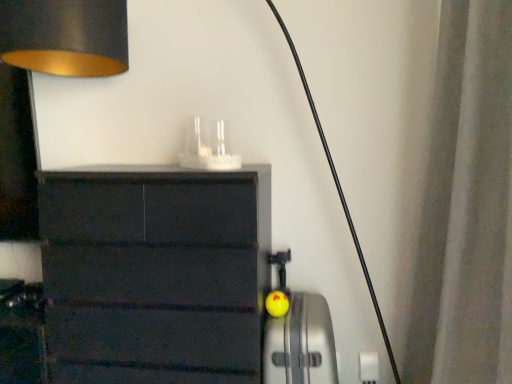
The image size is (512, 384). Describe the element at coordinates (466, 206) in the screenshot. I see `white fabric curtain at right` at that location.

In order to click on white fabric curtain at right in this screenshot , I will do `click(466, 206)`.

Measure the distance between white fabric curtain at right and camera.

white fabric curtain at right is 3.55 feet from camera.

Identify the location of yellow rubber ball at center. The height and width of the screenshot is (384, 512). (300, 343).

Describe the element at coordinates (300, 343) in the screenshot. I see `yellow rubber ball at center` at that location.

At what (x,y) coordinates should I click in order to perform the action: click on white fabric curtain at right. Please return your answer as a coordinate pair (x, y). The width and height of the screenshot is (512, 384). Looking at the image, I should click on (466, 206).

Considering the relative positions of white fabric curtain at right and yellow rubber ball at center in the image provided, is white fabric curtain at right to the right of yellow rubber ball at center from the viewer's perspective?

Yes, white fabric curtain at right is to the right of yellow rubber ball at center.

Is white fabric curtain at right in front of or behind yellow rubber ball at center in the image?

white fabric curtain at right is in front of yellow rubber ball at center.

Which is in front, point (454, 153) or point (289, 328)?

The point (454, 153) is closer to the camera.

From the image's perspective, which one is positioned lower, white fabric curtain at right or yellow rubber ball at center?

yellow rubber ball at center is shown below in the image.

From a real-world perspective, is white fabric curtain at right above or below yellow rubber ball at center?

white fabric curtain at right is above yellow rubber ball at center.

Which of these two, white fabric curtain at right or yellow rubber ball at center, is thinner?

white fabric curtain at right is thinner.

Considering the relative sizes of white fabric curtain at right and yellow rubber ball at center in the image provided, is white fabric curtain at right shorter than yellow rubber ball at center?

In fact, white fabric curtain at right may be taller than yellow rubber ball at center.

Considering the relative sizes of white fabric curtain at right and yellow rubber ball at center in the image provided, is white fabric curtain at right bigger than yellow rubber ball at center?

Yes.

Is white fabric curtain at right surrounding yellow rubber ball at center?

No, yellow rubber ball at center is not inside white fabric curtain at right.

Based on the photo, are white fabric curtain at right and yellow rubber ball at center beside each other?

No, white fabric curtain at right is not touching yellow rubber ball at center.

Could you tell me if white fabric curtain at right is facing yellow rubber ball at center?

Yes, white fabric curtain at right is aimed at yellow rubber ball at center.

How many degrees apart are the facing directions of white fabric curtain at right and yellow rubber ball at center?

white fabric curtain at right and yellow rubber ball at center are facing 91.6 degrees away from each other.

How far apart are white fabric curtain at right and yellow rubber ball at center?

white fabric curtain at right and yellow rubber ball at center are 22.27 inches apart.

Locate an element on the screen. curtain that is above the yellow rubber ball at center (from a real-world perspective) is located at coordinates (466, 206).

Between yellow rubber ball at center and white fabric curtain at right, which one appears on the right side from the viewer's perspective?

white fabric curtain at right is more to the right.

Considering their positions, is yellow rubber ball at center located in front of or behind white fabric curtain at right?

yellow rubber ball at center is behind white fabric curtain at right.

Considering the positions of points (328, 375) and (441, 24), is point (328, 375) closer to camera compared to point (441, 24)?

Yes, it is.

From the image's perspective, which is above, yellow rubber ball at center or white fabric curtain at right?

white fabric curtain at right appears higher in the image.

From a real-world perspective, is yellow rubber ball at center over white fabric curtain at right?

No, from a real-world perspective, yellow rubber ball at center is not over white fabric curtain at right

Can you confirm if yellow rubber ball at center is thinner than white fabric curtain at right?

Incorrect, the width of yellow rubber ball at center is not less than that of white fabric curtain at right.

Considering the relative sizes of yellow rubber ball at center and white fabric curtain at right in the image provided, is yellow rubber ball at center taller than white fabric curtain at right?

In fact, yellow rubber ball at center may be shorter than white fabric curtain at right.

Is yellow rubber ball at center smaller than white fabric curtain at right?

Yes, yellow rubber ball at center is smaller than white fabric curtain at right.

Is white fabric curtain at right surrounded by yellow rubber ball at center?

That's incorrect, white fabric curtain at right is not inside yellow rubber ball at center.

Is yellow rubber ball at center not near white fabric curtain at right?

That's not correct — yellow rubber ball at center is a little close to white fabric curtain at right.

Is yellow rubber ball at center facing towards white fabric curtain at right?

No.

From the picture: How many degrees apart are the facing directions of yellow rubber ball at center and white fabric curtain at right?

They differ by 91.6 degrees in their facing directions.

The width and height of the screenshot is (512, 384). I want to click on curtain above the yellow rubber ball at center (from a real-world perspective), so [x=466, y=206].

Locate an element on the screen. The image size is (512, 384). curtain in front of the yellow rubber ball at center is located at coordinates (466, 206).

This screenshot has height=384, width=512. Find the location of `curtain on the right side of yellow rubber ball at center`. curtain on the right side of yellow rubber ball at center is located at coordinates (466, 206).